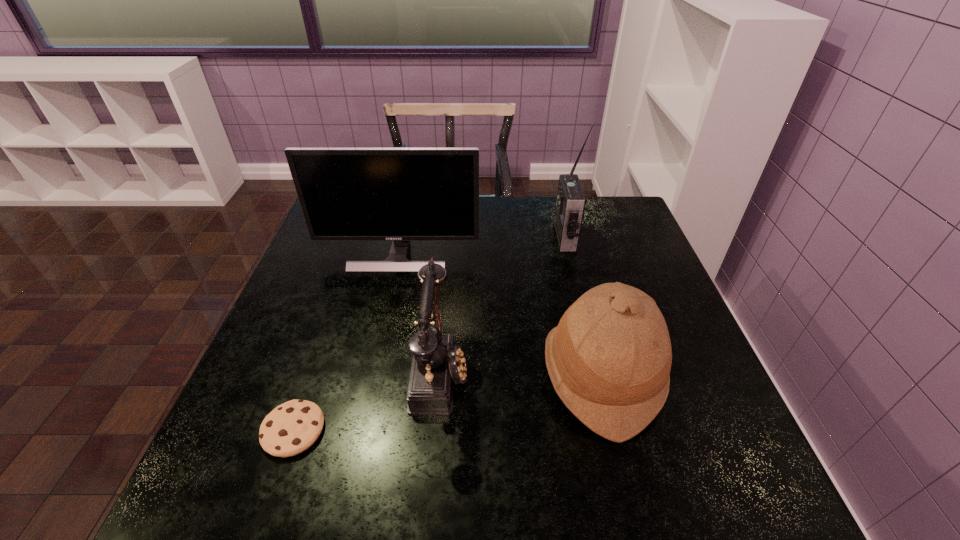
Identify the location of vacant point located between the monitor and the radio receiver. The width and height of the screenshot is (960, 540). (482, 246).

Identify the location of unoccupied area between the hat and the telephone. The height and width of the screenshot is (540, 960). (520, 372).

Where is `object that is the fourth nearest to the shortest object`? object that is the fourth nearest to the shortest object is located at coordinates (570, 205).

Choose which object is the third nearest neighbor to the monitor. Please provide its 2D coordinates. Your answer should be formatted as a tuple, i.e. [(x, y)], where the tuple contains the x and y coordinates of a point satisfying the conditions above.

[(570, 205)]

The width and height of the screenshot is (960, 540). Identify the location of vacant space that satisfies the following two spatial constraints: 1. on the display of the radio receiver; 2. on the screen side of the monitor. (570, 255).

This screenshot has width=960, height=540. What are the coordinates of `vacant position in the image that satisfies the following two spatial constraints: 1. on the dial of the telephone; 2. on the front side of the shortest object` in the screenshot? It's located at (435, 430).

Where is `free space that satisfies the following two spatial constraints: 1. on the front-facing side of the hat; 2. on the front side of the shortest object`? This screenshot has height=540, width=960. free space that satisfies the following two spatial constraints: 1. on the front-facing side of the hat; 2. on the front side of the shortest object is located at coordinates (615, 430).